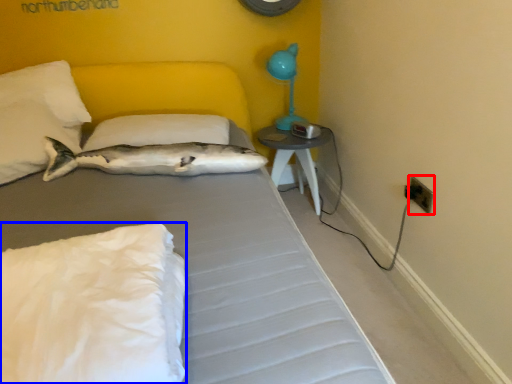
Question: Among these objects, which one is farthest to the camera, electric outlet (highlighted by a red box) or pillow (highlighted by a blue box)?

Choices:
 (A) electric outlet
 (B) pillow

Answer: (A)